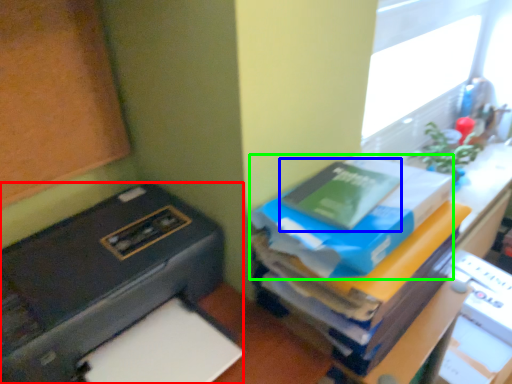
Question: Considering the real-world distances, which object is closest to printer (highlighted by a red box)? paperback book (highlighted by a blue box) or paperback book (highlighted by a green box).

Choices:
 (A) paperback book
 (B) paperback book

Answer: (B)